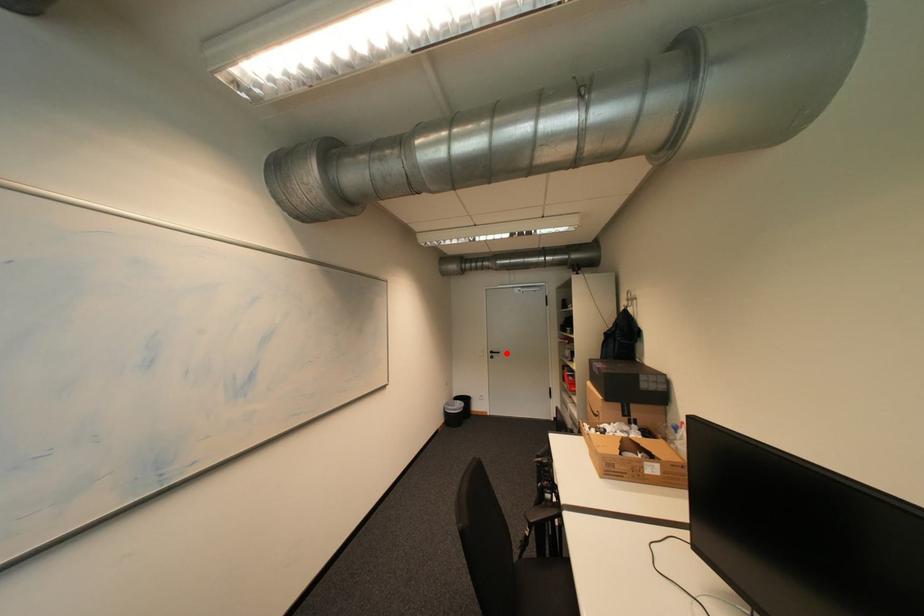
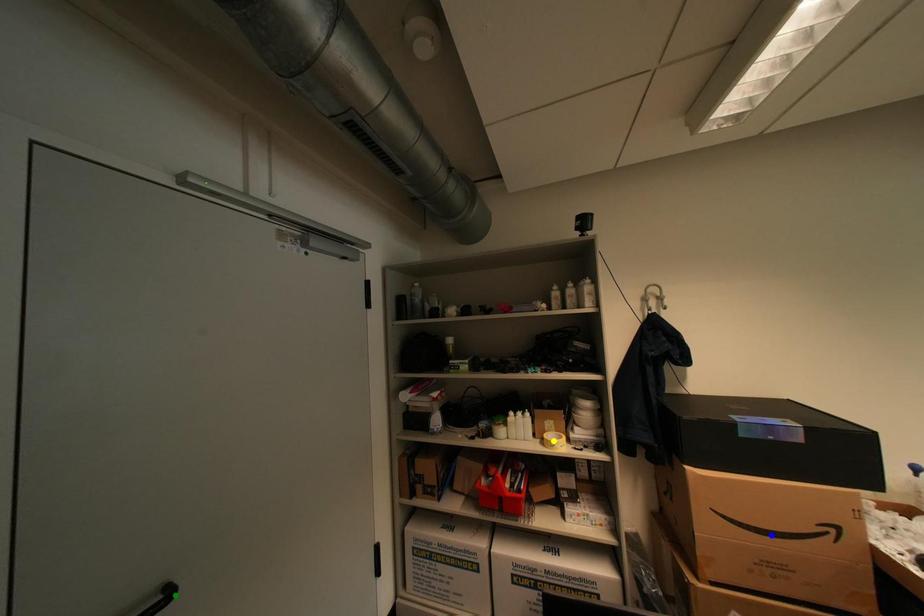
Question: I am providing you with two images of the same scene from different viewpoints. A red point is marked on the first image. You are given multiple points on the second image. Can you choose the point in image 2 that corresponds to the point in image 1?

Choices:
 (A) yellow point
 (B) blue point
 (C) green point

Answer: (C)